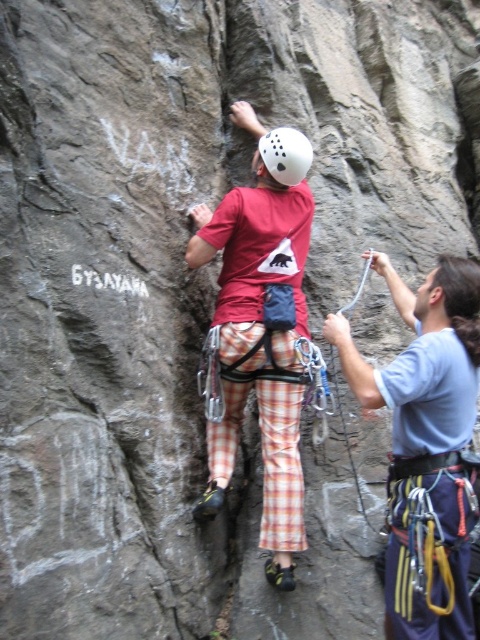
Question: Is blue fabric rope at right positioned behind matte red shirt at center?

Choices:
 (A) yes
 (B) no

Answer: (B)

Question: Which of the following is the farthest from the observer?

Choices:
 (A) (269, 163)
 (B) (336, 317)

Answer: (A)

Question: Which of the following is the closest to the observer?

Choices:
 (A) (458, 572)
 (B) (295, 141)

Answer: (A)

Question: Does matte red shirt at center appear on the right side of white matte helmet at center?

Choices:
 (A) no
 (B) yes

Answer: (A)

Question: Which of the following is the farthest from the observer?

Choices:
 (A) (403, 317)
 (B) (276, 177)
 (C) (286, 557)

Answer: (A)

Question: Does blue fabric rope at right come in front of white matte helmet at center?

Choices:
 (A) yes
 (B) no

Answer: (A)